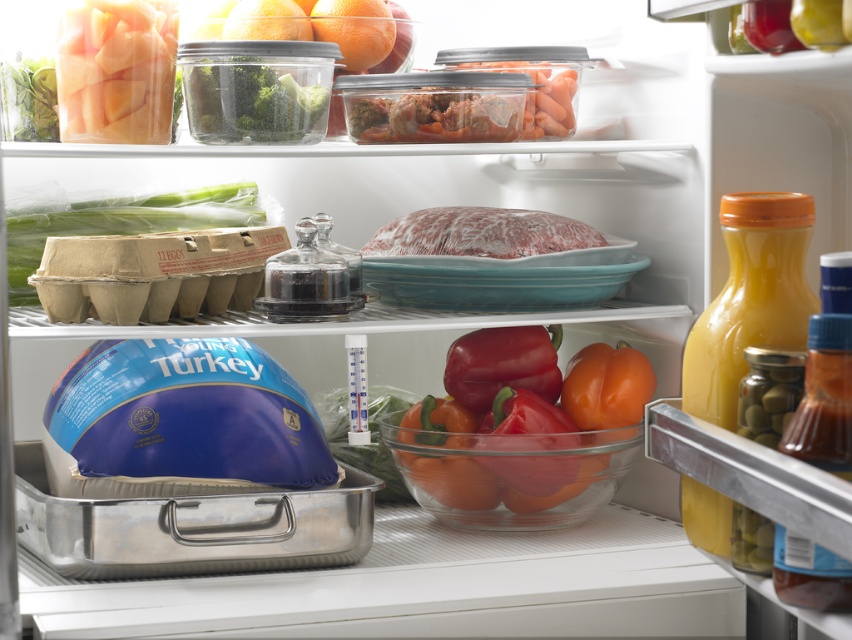
You are organizing the fridge and need to place a new item that requires more vertical space. Which object in the fridge currently occupies a taller space, the yellow glass bottle at right or the translucent plastic broccoli at upper left?

The yellow glass bottle at right is taller than the translucent plastic broccoli at upper left, so it occupies more vertical space.